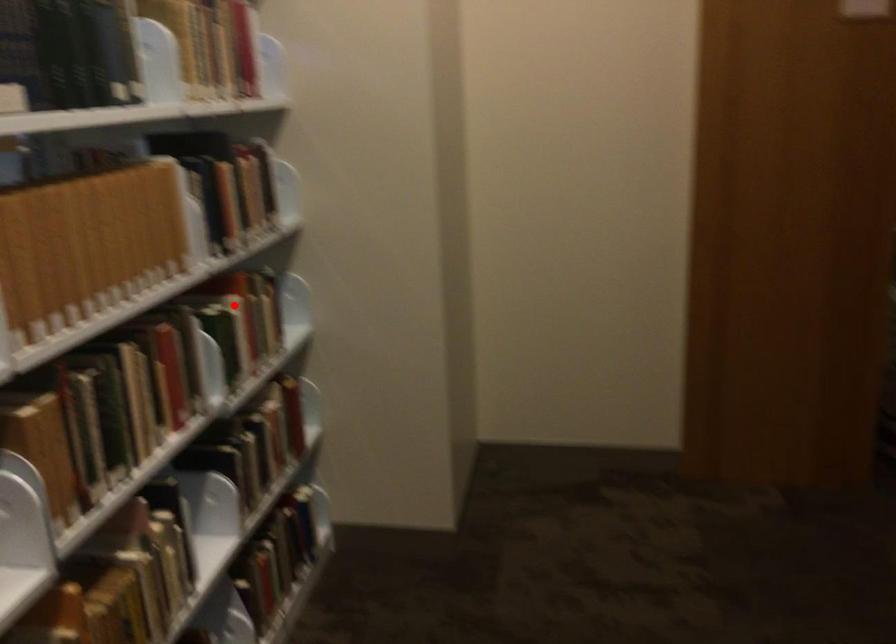
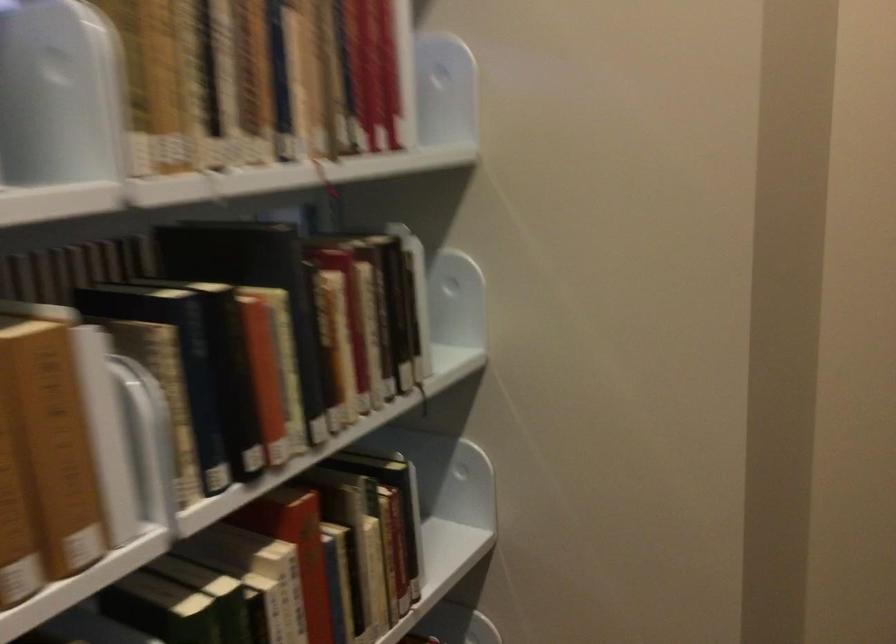
Find the pixel in the second image that matches the highlighted location in the first image.

(289, 564)